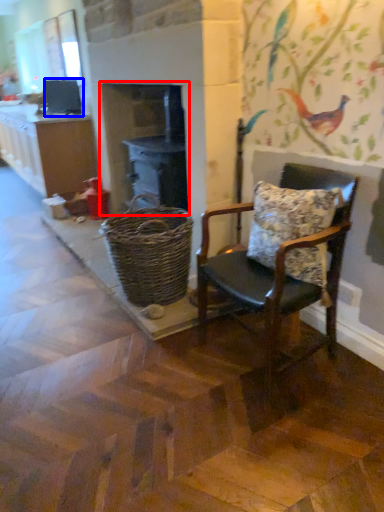
Question: Which object appears farthest to the camera in this image, fireplace (highlighted by a red box) or appliance (highlighted by a blue box)?

Choices:
 (A) fireplace
 (B) appliance

Answer: (B)